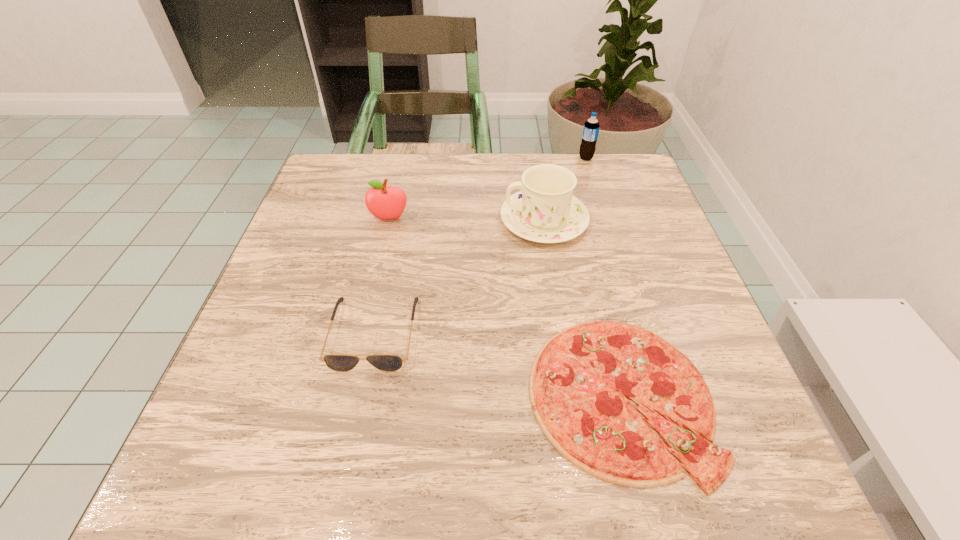
At what (x,y) coordinates should I click in order to perform the action: click on free space that satisfies the following two spatial constraints: 1. on the front side of the soda bottle; 2. on the handle side of the chinaware. Please return your answer as a coordinate pair (x, y). Image resolution: width=960 pixels, height=540 pixels. Looking at the image, I should click on click(606, 220).